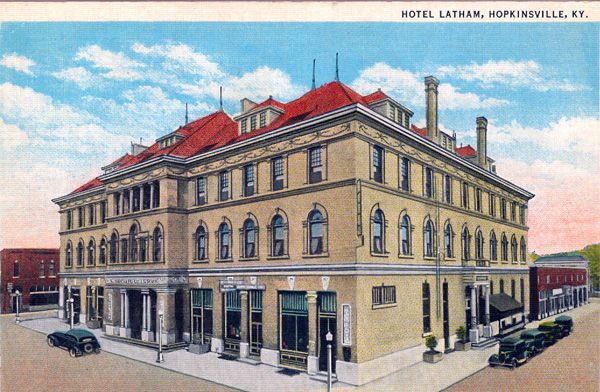
You are a GUI agent. You are given a task and a screenshot of the screen. Output one action in this format:
    pyautogui.click(x=<x>, y=<y>)
    Task: Click on the doors
    
    Given the screenshot: What is the action you would take?
    [x=136, y=310], [x=477, y=311]